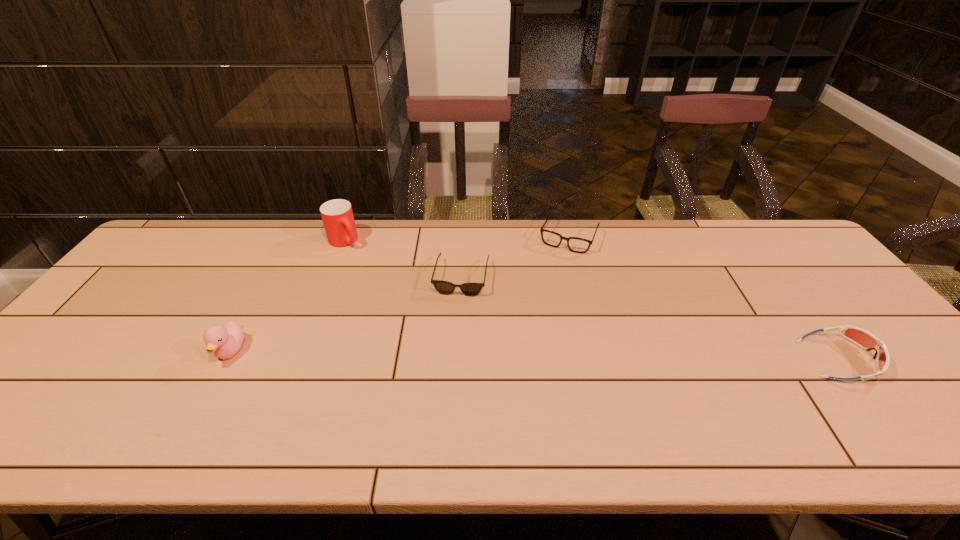
Locate an element on the screen. This screenshot has width=960, height=540. the second closest object relative to the spectacles is located at coordinates (863, 338).

This screenshot has width=960, height=540. Identify the location of vacant position in the image that satisfies the following two spatial constraints: 1. on the front side of the goggles; 2. on the front-facing side of the third farthest object. (458, 359).

Identify the location of free spot that satisfies the following two spatial constraints: 1. on the front side of the cup; 2. on the front-facing side of the rightmost object. The width and height of the screenshot is (960, 540). (298, 359).

Locate an element on the screen. The height and width of the screenshot is (540, 960). free space that satisfies the following two spatial constraints: 1. on the front-facing side of the goggles; 2. on the front-facing side of the leftmost object is located at coordinates (227, 359).

Identify the location of free location that satisfies the following two spatial constraints: 1. on the front-facing side of the rightmost object; 2. on the front-facing side of the leftmost object. The height and width of the screenshot is (540, 960). pos(227,359).

Identify the location of free space that satisfies the following two spatial constraints: 1. on the front side of the rightmost object; 2. on the front-facing side of the sunglasses. The image size is (960, 540). (458, 359).